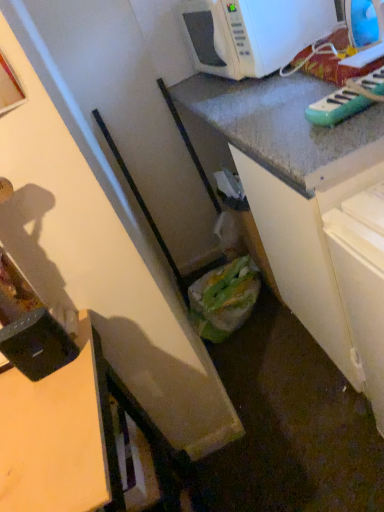
Question: Is wooden desk at lower left taller or shorter than black plastic container at lower left, the 1th appliance in the bottom-to-top sequence?

Choices:
 (A) short
 (B) tall

Answer: (B)

Question: Relative to black plastic container at lower left, marked as the second appliance in a right-to-left arrangement, is wooden desk at lower left in front or behind?

Choices:
 (A) behind
 (B) front

Answer: (B)

Question: Estimate the real-world distances between objects in this image. Which object is closer to the wooden desk at lower left?

Choices:
 (A) white glossy microwave at upper right
 (B) black plastic container at lower left, acting as the 1th appliance starting from the left
 (C) green plastic bag at lower center
 (D) green plastic toy keyboard at upper right, the first appliance viewed from the right

Answer: (B)

Question: Estimate the real-world distances between objects in this image. Which object is farther from the green plastic toy keyboard at upper right, which is the second appliance from bottom to top?

Choices:
 (A) black plastic container at lower left, marked as the second appliance in a right-to-left arrangement
 (B) white glossy microwave at upper right
 (C) wooden desk at lower left
 (D) green plastic bag at lower center

Answer: (D)